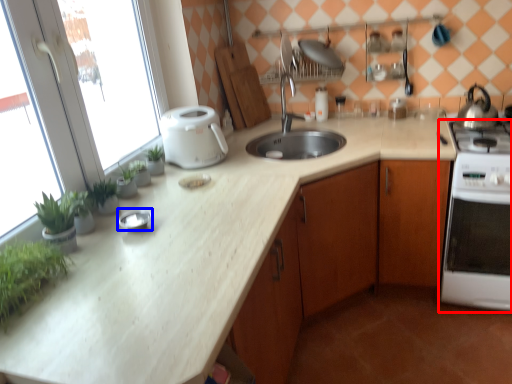
Question: Which object appears closest to the camera in this image, home appliance (highlighted by a red box) or appliance (highlighted by a blue box)?

Choices:
 (A) home appliance
 (B) appliance

Answer: (B)